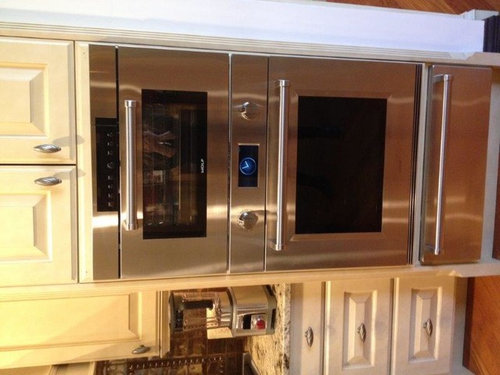
Locate an element on the screen. This screenshot has height=375, width=500. oven is located at coordinates (352, 176).